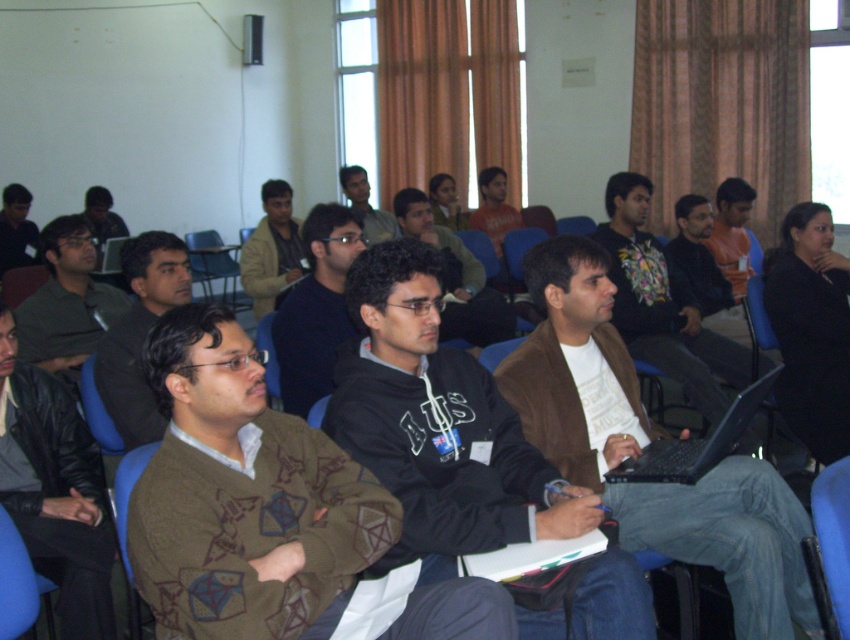
Question: Which point appears closest to the camera in this image?

Choices:
 (A) (643, 243)
 (B) (683, 460)

Answer: (B)

Question: Based on their relative distances, which object is farther from the white cotton shirt at center?

Choices:
 (A) brown suede jacket at center
 (B) dark brown leather jacket at center
 (C) black plastic laptop at center
 (D) dark blue sweater at center

Answer: (A)

Question: From the image, what is the correct spatial relationship of black matte hoodie at center in relation to dark brown leather jacket at center?

Choices:
 (A) above
 (B) below

Answer: (B)

Question: Is brown leather jacket at center below dark blue sweater at center?

Choices:
 (A) yes
 (B) no

Answer: (A)

Question: Is dark blue sweater at center above dark green sweater at left?

Choices:
 (A) yes
 (B) no

Answer: (B)

Question: Which object is farther from the camera taking this photo?

Choices:
 (A) orange fabric shirt at right
 (B) dark green sweater at left
 (C) matte black laptop at upper left
 (D) dark blue sweater at center

Answer: (C)